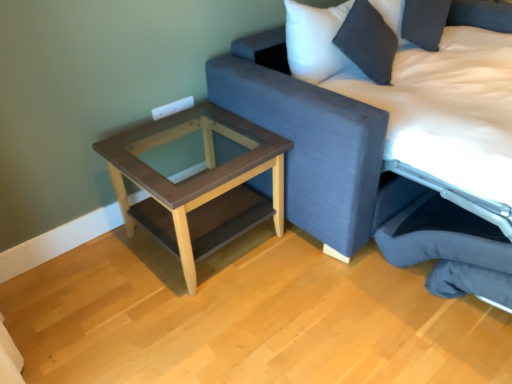
Question: Which is correct: textured fabric studio couch at upper right is inside brown wood table at lower left, or outside of it?

Choices:
 (A) outside
 (B) inside

Answer: (A)

Question: From the image's perspective, relative to brown wood table at lower left, is textured fabric studio couch at upper right above or below?

Choices:
 (A) below
 (B) above

Answer: (B)

Question: Based on their relative distances, which object is farther from the brown wood table at lower left?

Choices:
 (A) dark gray fabric swivel chair at lower right
 (B) textured fabric studio couch at upper right

Answer: (A)

Question: Estimate the real-world distances between objects in this image. Which object is farther from the textured fabric studio couch at upper right?

Choices:
 (A) brown wood table at lower left
 (B) dark gray fabric swivel chair at lower right

Answer: (A)